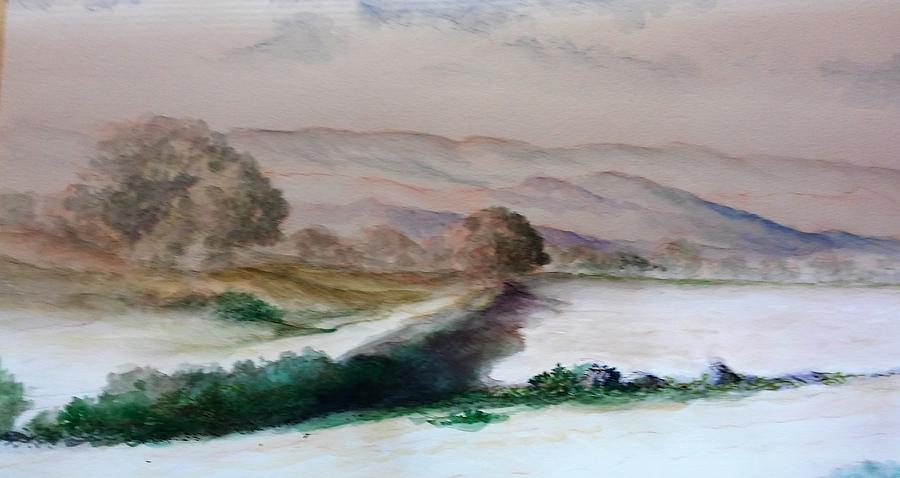
I want to click on painting, so click(x=434, y=278).